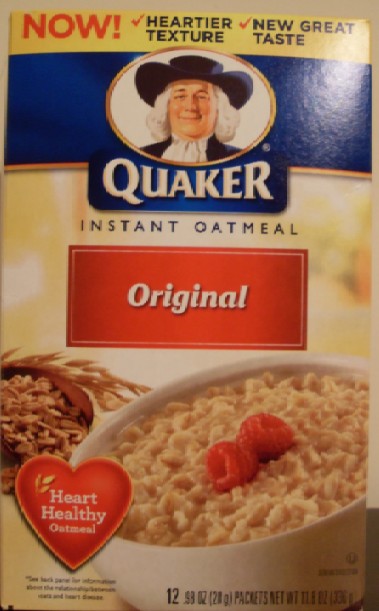
The image size is (379, 611). I want to click on white bowl, so click(287, 550).